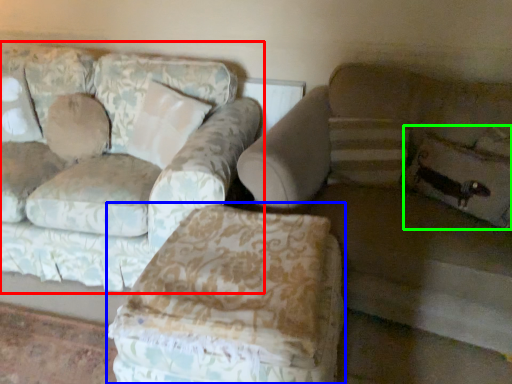
Question: Estimate the real-world distances between objects in this image. Which object is farther from studio couch (highlighted by a red box), swivel chair (highlighted by a blue box) or pillow (highlighted by a green box)?

Choices:
 (A) swivel chair
 (B) pillow

Answer: (B)